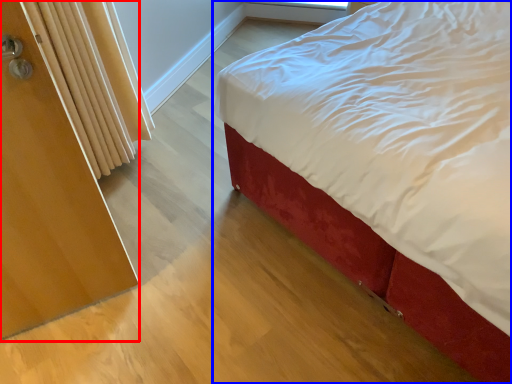
Question: Which object is closer to the camera taking this photo, screen door (highlighted by a red box) or bed (highlighted by a blue box)?

Choices:
 (A) screen door
 (B) bed

Answer: (B)